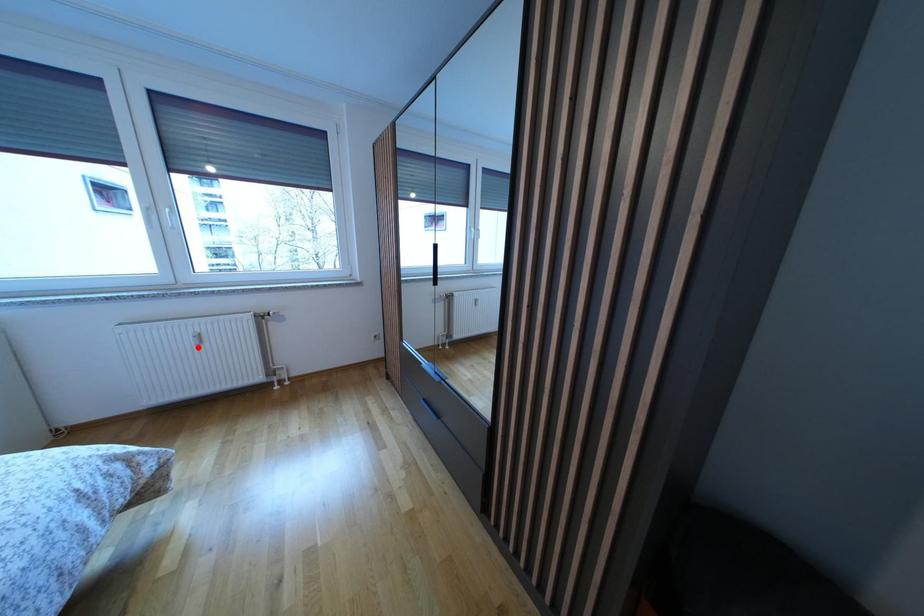
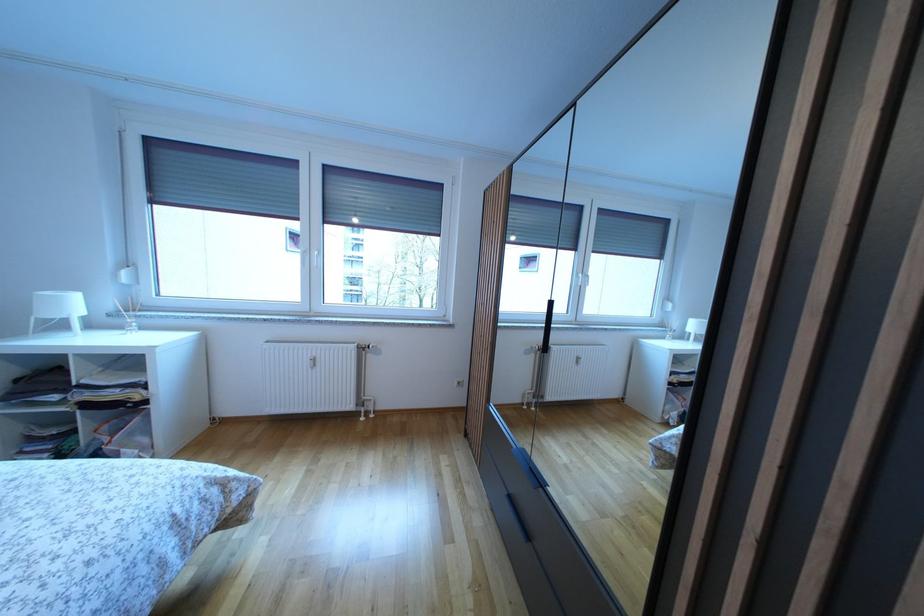
Question: I am providing you with two images of the same scene from different viewpoints. Given a red point in image1, look at the same physical point in image2. Is it:

Choices:
 (A) Closer to the viewpoint
 (B) Farther from the viewpoint

Answer: (B)